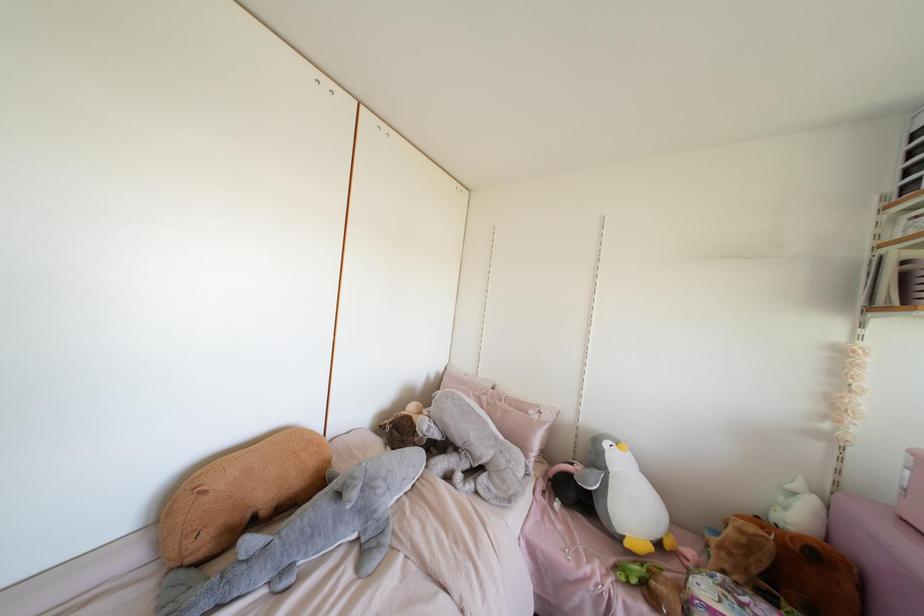
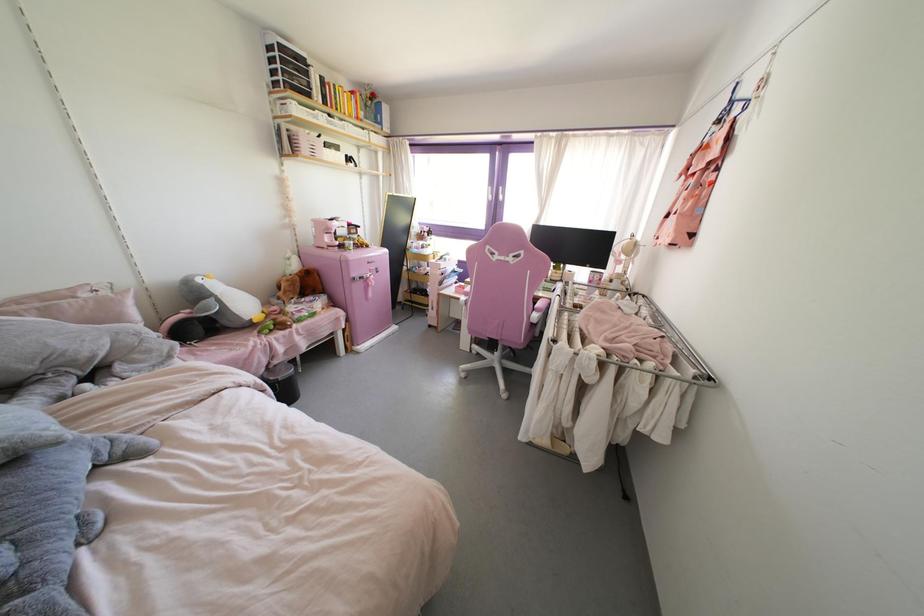
Locate, in the second image, the point that corresponds to the point at 626,544 in the first image.

(254, 320)